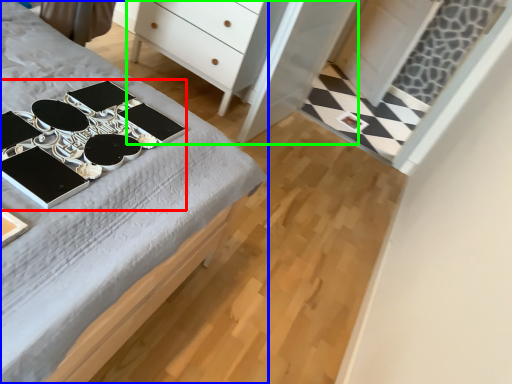
Question: Estimate the real-world distances between objects in this image. Which object is farther from changing table (highlighted by a red box), desk (highlighted by a blue box) or dresser (highlighted by a green box)?

Choices:
 (A) desk
 (B) dresser

Answer: (B)